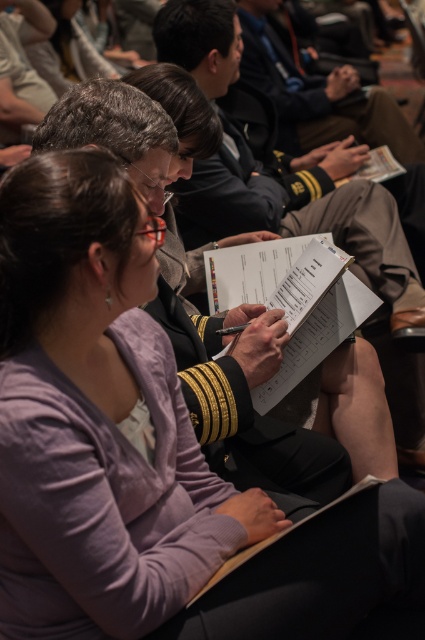
You are attending a conference and need to find the uniformed officer at center to ask a question. You see the navy blue uniform at upper center. Which one is closer to you?

The uniformed officer at center is closer to you than the navy blue uniform at upper center because the uniformed officer at center is positioned under the navy blue uniform at upper center.

You are standing in the auditorium and want to take a photo of the two points in the scene. Which point, point (226, 284) or point (371, 129), will appear larger in your photo?

Point (226, 284) will appear larger in the photo because it is closer to the camera than point (371, 129).

Where is the uniformed officer at center located in the image?

The uniformed officer at center is located at point 0.294 on the x axis and 0.609 on the y axis.